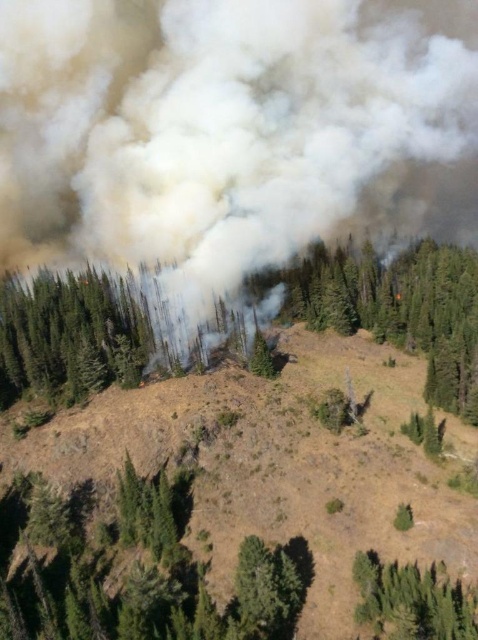
Is white smoke at center below green rough bark tree at center?

Actually, white smoke at center is above green rough bark tree at center.

Can you confirm if white smoke at center is bigger than green rough bark tree at center?

Yes, white smoke at center is bigger than green rough bark tree at center.

Identify the location of white smoke at center. (232, 132).

Can you confirm if green matte tree at center-left is thinner than green leafy tree at lower right?

Incorrect, green matte tree at center-left's width is not less than green leafy tree at lower right's.

Which is above, green matte tree at center-left or green leafy tree at lower right?

green matte tree at center-left

Identify the location of green matte tree at center-left. The height and width of the screenshot is (640, 478). (69, 333).

Is white smoke at center smaller than green leafy tree at center?

No, white smoke at center is not smaller than green leafy tree at center.

Describe the element at coordinates (232, 132) in the screenshot. I see `white smoke at center` at that location.

The height and width of the screenshot is (640, 478). I want to click on white smoke at center, so click(x=232, y=132).